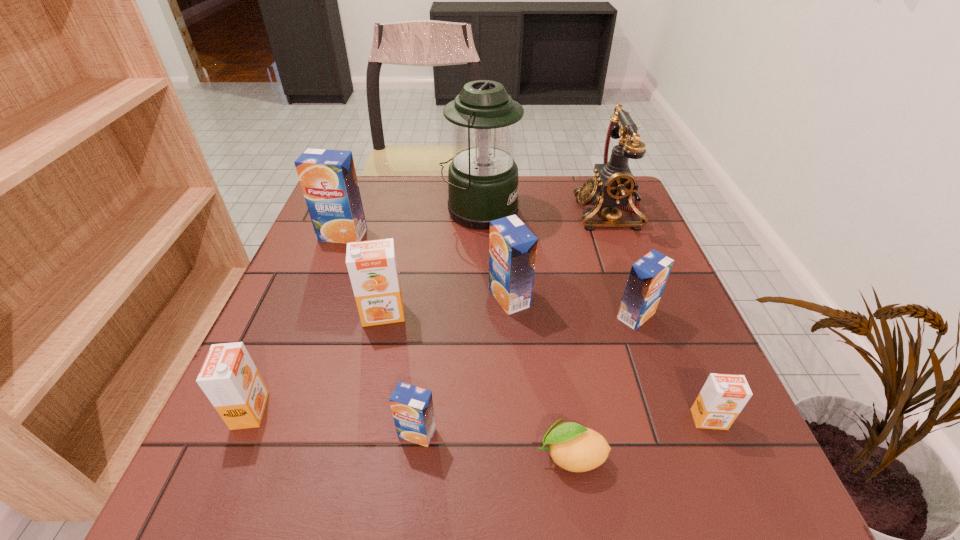
Where is `vacant position located 0.120m with leaves positioned above the lemon`? The width and height of the screenshot is (960, 540). vacant position located 0.120m with leaves positioned above the lemon is located at coordinates (459, 456).

Identify the location of lantern present at the far edge. (482, 181).

Locate an element on the screen. This screenshot has width=960, height=540. telephone at the far edge is located at coordinates tap(614, 186).

Where is `object situated at the near edge`? The height and width of the screenshot is (540, 960). object situated at the near edge is located at coordinates (573, 447).

This screenshot has height=540, width=960. Identify the location of telephone that is at the right edge. (614, 186).

This screenshot has width=960, height=540. In order to click on object present at the far right corner in this screenshot , I will do `click(614, 186)`.

Identify the location of free spot at the far edge of the desktop. The height and width of the screenshot is (540, 960). (557, 215).

This screenshot has width=960, height=540. What are the coordinates of `blank space at the near edge of the desktop` in the screenshot? It's located at (638, 488).

Where is `free space at the left edge of the desktop`? free space at the left edge of the desktop is located at coordinates (325, 296).

This screenshot has height=540, width=960. In the image, there is a desktop. Identify the location of free space at the right edge. (690, 415).